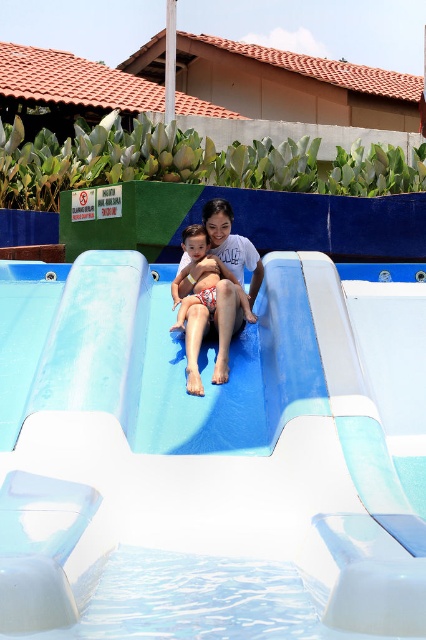
You are at the water park and want to locate the white smooth slide at center. According to the coordinates provided, where exactly is it positioned?

The white smooth slide at center is located at point 0.717 on the x axis and 0.493 on the y axis.

You are at a water park and see the white smooth slide at center and the matte skin child at center. Which object is smaller in size?

The white smooth slide at center is smaller in size compared to the matte skin child at center.

You are a safety inspector checking the water slide area. You notice the white smooth slide at center and the white textured shorts at center. According to safety regulations, the minimum distance between any part of the slide and any personal items left unattended must be at least 2 meters. Is the current distance compliant with the regulation?

The white smooth slide at center and white textured shorts at center are 2.21 meters apart from each other, which exceeds the required minimum distance of 2 meters. Therefore, the current distance is compliant with the safety regulation.